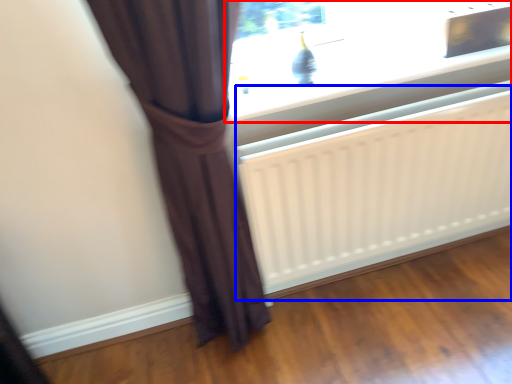
Question: Among these objects, which one is farthest to the camera, window (highlighted by a red box) or radiator (highlighted by a blue box)?

Choices:
 (A) window
 (B) radiator

Answer: (A)